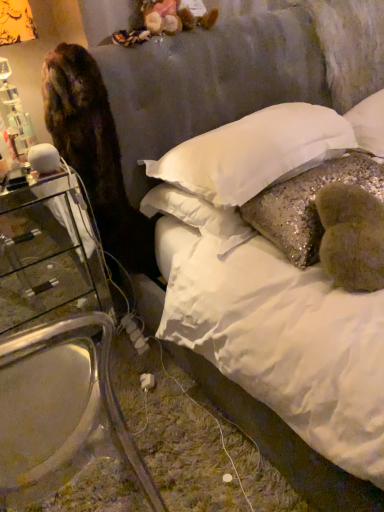
Image resolution: width=384 pixels, height=512 pixels. What do you see at coordinates (47, 254) in the screenshot? I see `clear glass nightstand at left` at bounding box center [47, 254].

Based on the photo, measure the distance between glittery sequined pillow at center, the 2th pillow positioned from the left, and camera.

They are 1.17 meters apart.

Based on the photo, in order to face white soft pillow at upper center, the 3th pillow viewed from the left, should I rotate leftwards or rightwards?

Rotate right and turn 24.699 degrees.

What do you see at coordinates (369, 123) in the screenshot? I see `white soft pillow at upper center, the 3th pillow viewed from the left` at bounding box center [369, 123].

Where is `brown fur cat at left`? The image size is (384, 512). brown fur cat at left is located at coordinates (95, 153).

Locate an element on the screen. This screenshot has width=384, height=512. white sequined pillow at center, the 1th pillow in the left-to-right sequence is located at coordinates (254, 153).

Between white sequined pillow at center, the 1th pillow in the left-to-right sequence, and transparent glass armchair at left, which one has smaller width?

Thinner between the two is white sequined pillow at center, the 1th pillow in the left-to-right sequence.

In the image, is white sequined pillow at center, which is counted as the 3th pillow, starting from the right, on the left side or the right side of transparent glass armchair at left?

Clearly, white sequined pillow at center, which is counted as the 3th pillow, starting from the right, is on the right of transparent glass armchair at left in the image.

Is white sequined pillow at center, which is counted as the 3th pillow, starting from the right, turned away from transparent glass armchair at left?

No, white sequined pillow at center, which is counted as the 3th pillow, starting from the right,'s orientation is not away from transparent glass armchair at left.

Which of these two, white sequined pillow at center, which is counted as the 3th pillow, starting from the right, or transparent glass armchair at left, stands taller?

Standing taller between the two is transparent glass armchair at left.

Is clear glass nightstand at left positioned with its back to glittery sequined pillow at center, the 2th pillow positioned from the left?

clear glass nightstand at left does not have its back to glittery sequined pillow at center, the 2th pillow positioned from the left.

Can you tell me how much clear glass nightstand at left and glittery sequined pillow at center, the 2th pillow positioned from the left, differ in facing direction?

clear glass nightstand at left and glittery sequined pillow at center, the 2th pillow positioned from the left, are facing 1.34 degrees away from each other.

In the scene shown: Between clear glass nightstand at left and glittery sequined pillow at center, positioned as the second pillow in right-to-left order, which one has less height?

Standing shorter between the two is glittery sequined pillow at center, positioned as the second pillow in right-to-left order.

Which is in front, point (67, 293) or point (289, 208)?

The point (289, 208) is in front.

Considering the sizes of objects white soft pillow at upper center, which appears as the 1th pillow when viewed from the right, and clear glass nightstand at left in the image provided, who is shorter, white soft pillow at upper center, which appears as the 1th pillow when viewed from the right, or clear glass nightstand at left?

With less height is white soft pillow at upper center, which appears as the 1th pillow when viewed from the right.

Is white soft pillow at upper center, the 3th pillow viewed from the left, surrounding clear glass nightstand at left?

Actually, clear glass nightstand at left is outside white soft pillow at upper center, the 3th pillow viewed from the left.

Considering the positions of objects white soft pillow at upper center, the 3th pillow viewed from the left, and clear glass nightstand at left in the image provided, who is more to the right, white soft pillow at upper center, the 3th pillow viewed from the left, or clear glass nightstand at left?

white soft pillow at upper center, the 3th pillow viewed from the left.

From a real-world perspective, which object stands above the other?

white soft pillow at upper center, which appears as the 1th pillow when viewed from the right, from a real-world perspective.

Where is `nightstand in front of the white soft pillow at upper center, the 3th pillow viewed from the left`? nightstand in front of the white soft pillow at upper center, the 3th pillow viewed from the left is located at coordinates (47, 254).

Is clear glass nightstand at left not within white soft pillow at upper center, which appears as the 1th pillow when viewed from the right?

Absolutely, clear glass nightstand at left is external to white soft pillow at upper center, which appears as the 1th pillow when viewed from the right.

Between clear glass nightstand at left and white soft pillow at upper center, the 3th pillow viewed from the left, which one appears on the left side from the viewer's perspective?

clear glass nightstand at left is more to the left.

Considering the sizes of objects white soft pillow at upper center, which appears as the 1th pillow when viewed from the right, and white sequined pillow at center, which is counted as the 3th pillow, starting from the right, in the image provided, who is wider, white soft pillow at upper center, which appears as the 1th pillow when viewed from the right, or white sequined pillow at center, which is counted as the 3th pillow, starting from the right,?

Wider between the two is white sequined pillow at center, which is counted as the 3th pillow, starting from the right.

Is white soft pillow at upper center, the 3th pillow viewed from the left, shorter than white sequined pillow at center, the 1th pillow in the left-to-right sequence?

No.

Measure the distance from white soft pillow at upper center, the 3th pillow viewed from the left, to white sequined pillow at center, which is counted as the 3th pillow, starting from the right.

white soft pillow at upper center, the 3th pillow viewed from the left, is 21.31 inches from white sequined pillow at center, which is counted as the 3th pillow, starting from the right.

Which point is more distant from viewer, (379,132) or (302,170)?

Positioned behind is point (379,132).

From the image's perspective, which object appears higher, clear glass nightstand at left or transparent glass armchair at left?

clear glass nightstand at left appears higher in the image.

Is clear glass nightstand at left surrounding transparent glass armchair at left?

No, transparent glass armchair at left is not inside clear glass nightstand at left.

The height and width of the screenshot is (512, 384). What are the coordinates of `nightstand that appears above the transparent glass armchair at left (from the image's perspective)` in the screenshot? It's located at (47, 254).

Who is bigger, clear glass nightstand at left or transparent glass armchair at left?

Bigger between the two is transparent glass armchair at left.

Which of these two, brown fur cat at left or white sequined pillow at center, the 1th pillow in the left-to-right sequence, is smaller?

brown fur cat at left.

Is point (100, 121) less distant than point (175, 151)?

Yes, it is.

Is brown fur cat at left wider than white sequined pillow at center, the 1th pillow in the left-to-right sequence?

Incorrect, the width of brown fur cat at left does not surpass that of white sequined pillow at center, the 1th pillow in the left-to-right sequence.

Identify the location of armchair that appears on the left of white sequined pillow at center, the 1th pillow in the left-to-right sequence. This screenshot has width=384, height=512. (99, 382).

From the clear glass nightstand at left, count 2nd pillow to the right and point to it. Please provide its 2D coordinates.

[(308, 204)]

Based on their spatial positions, is transparent glass armchair at left or clear glass nightstand at left further from glittery sequined pillow at center, positioned as the second pillow in right-to-left order?

Based on the image, clear glass nightstand at left appears to be further to glittery sequined pillow at center, positioned as the second pillow in right-to-left order.

Based on their spatial positions, is white soft pillow at upper center, the 3th pillow viewed from the left, or clear glass nightstand at left further from brown fur cat at left?

white soft pillow at upper center, the 3th pillow viewed from the left, is positioned further to the anchor brown fur cat at left.

From the image, which object appears to be nearer to clear glass nightstand at left, white soft pillow at upper center, the 3th pillow viewed from the left, or brown fur cat at left?

brown fur cat at left is closer to clear glass nightstand at left.

From the image, which object appears to be farther from brown fur cat at left, white sequined pillow at center, the 1th pillow in the left-to-right sequence, or transparent glass armchair at left?

transparent glass armchair at left lies further to brown fur cat at left than the other object.

From the image, which object appears to be farther from transparent glass armchair at left, clear glass nightstand at left or brown fur cat at left?

brown fur cat at left lies further to transparent glass armchair at left than the other object.

Looking at this image, which object lies nearer to the anchor point transparent glass armchair at left, white soft pillow at upper center, the 3th pillow viewed from the left, or clear glass nightstand at left?

clear glass nightstand at left.

Estimate the real-world distances between objects in this image. Which object is closer to white soft pillow at upper center, which appears as the 1th pillow when viewed from the right, white sequined pillow at center, the 1th pillow in the left-to-right sequence, or glittery sequined pillow at center, the 2th pillow positioned from the left?

The object closer to white soft pillow at upper center, which appears as the 1th pillow when viewed from the right, is glittery sequined pillow at center, the 2th pillow positioned from the left.

Which object lies nearer to the anchor point white sequined pillow at center, which is counted as the 3th pillow, starting from the right, clear glass nightstand at left or transparent glass armchair at left?

The object closer to white sequined pillow at center, which is counted as the 3th pillow, starting from the right, is clear glass nightstand at left.

What are the coordinates of `animal between transparent glass armchair at left and clear glass nightstand at left along the z-axis` in the screenshot? It's located at pos(95,153).

Image resolution: width=384 pixels, height=512 pixels. Identify the location of pillow between brown fur cat at left and glittery sequined pillow at center, the 2th pillow positioned from the left. (254, 153).

Where is `animal between white sequined pillow at center, the 1th pillow in the left-to-right sequence, and transparent glass armchair at left in the up-down direction`? animal between white sequined pillow at center, the 1th pillow in the left-to-right sequence, and transparent glass armchair at left in the up-down direction is located at coordinates (95, 153).

Find the location of a particular element. The width and height of the screenshot is (384, 512). animal between transparent glass armchair at left and white soft pillow at upper center, which appears as the 1th pillow when viewed from the right, in the horizontal direction is located at coordinates (95, 153).